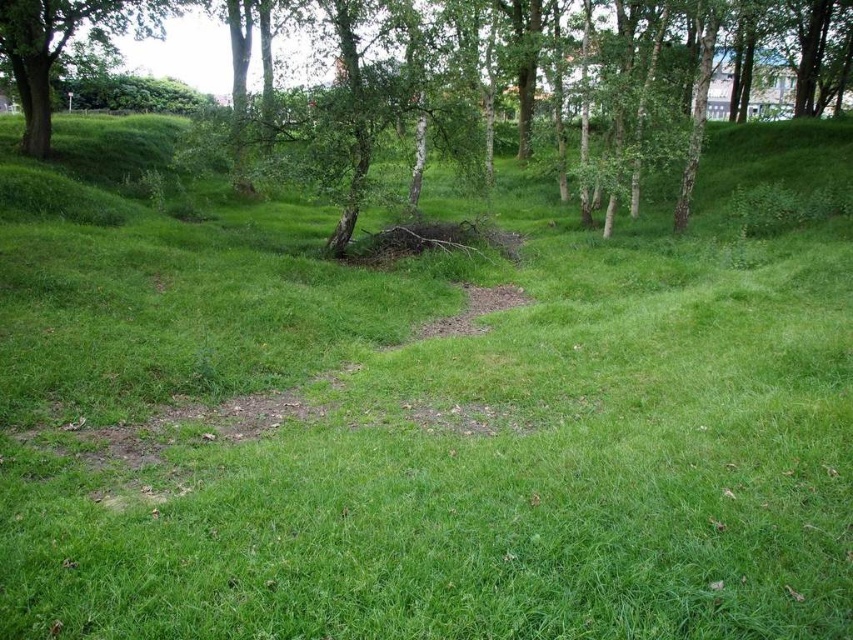
Looking at this image, you are planning to plant a new tree in this area. Considering the spacing between the green leafy tree at upper center and the green leafy tree at upper left, which tree would allow more space for the new tree to grow on its right side?

The green leafy tree at upper center has a greater width than the green leafy tree at upper left, so planting the new tree on the right side of the green leafy tree at upper center would provide more space for growth.

You are a bird looking for a nesting spot. You see two trees in the image, the green leafy tree at upper center and the green leafy tree at upper left. Which tree would you choose for nesting if you prefer a taller tree?

The green leafy tree at upper center is taller than the green leafy tree at upper left, so you should choose the green leafy tree at upper center for nesting.